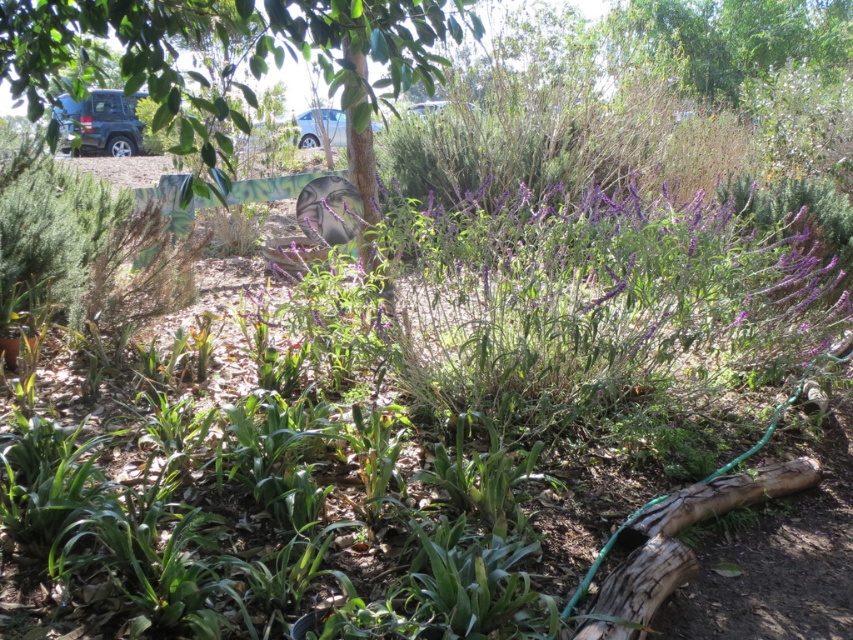
Question: Does green leafy tree at center appear over green leafy plant at lower left?

Choices:
 (A) yes
 (B) no

Answer: (A)

Question: Which object is farther from the camera taking this photo?

Choices:
 (A) green leafy tree at center
 (B) green leafy plant at lower left

Answer: (B)

Question: Which of the following is the closest to the observer?

Choices:
 (A) (157, 93)
 (B) (32, 352)

Answer: (A)

Question: Is the position of green leafy tree at center less distant than that of green leafy plant at lower left?

Choices:
 (A) no
 (B) yes

Answer: (B)

Question: Does green leafy tree at center appear under green leafy plant at lower left?

Choices:
 (A) no
 (B) yes

Answer: (A)